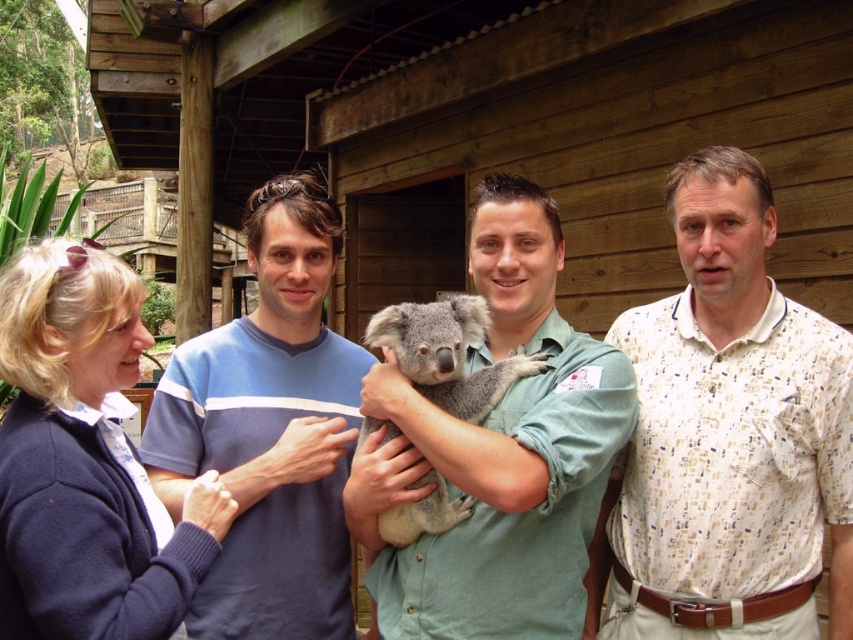
You are standing in front of the group at the zoo and want to hand a brochure to the person wearing the white printed shirt at right. Which direction should you move to reach them first, considering their position relative to the blue cotton sweater at center?

The white printed shirt at right is closer to the viewer than the blue cotton sweater at center, so you should move towards the right side of the group to reach the person wearing the white printed shirt at right first.

You are a photographer trying to capture a group photo of the white printed shirt at right and the green shirt at center. Which of the two should you move closer to the camera to make their sizes appear more balanced in the photo?

The white printed shirt at right is thinner than the green shirt at center, so you should move the white printed shirt at right closer to the camera to balance their sizes in the photo.

In the scene described, there are two men wearing shirts with different colors and patterns. The white printed shirt at right and the green shirt at center. Which shirt is positioned more to the right side of the image?

The white printed shirt at right is positioned more to the right side of the image as it is located to the right of the green shirt at center.